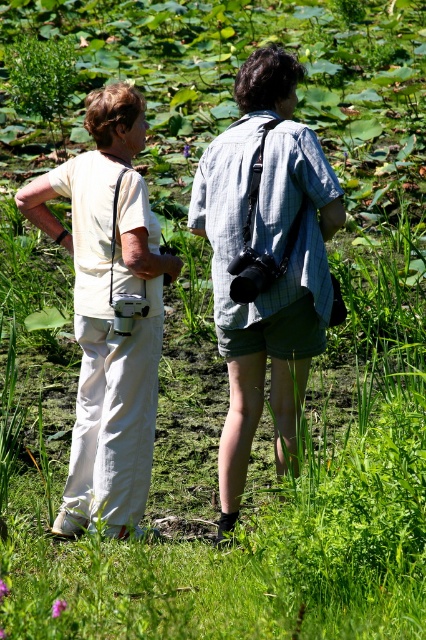
Question: Which of the following is the closest to the observer?

Choices:
 (A) (75, 234)
 (B) (135, 195)
 (C) (253, 305)

Answer: (C)

Question: Is matte white pants at left to the right of matte blue shirt at center from the viewer's perspective?

Choices:
 (A) yes
 (B) no

Answer: (B)

Question: Is matte white pants at left thinner than white cotton pants at left?

Choices:
 (A) yes
 (B) no

Answer: (B)

Question: Which point appears farthest from the camera in this image?

Choices:
 (A) (241, 230)
 (B) (273, 250)
 (C) (155, 353)

Answer: (C)

Question: Is matte blue shirt at center smaller than white cotton pants at left?

Choices:
 (A) no
 (B) yes

Answer: (A)

Question: Which object appears farthest from the camera in this image?

Choices:
 (A) white cotton pants at left
 (B) matte blue shirt at center

Answer: (A)